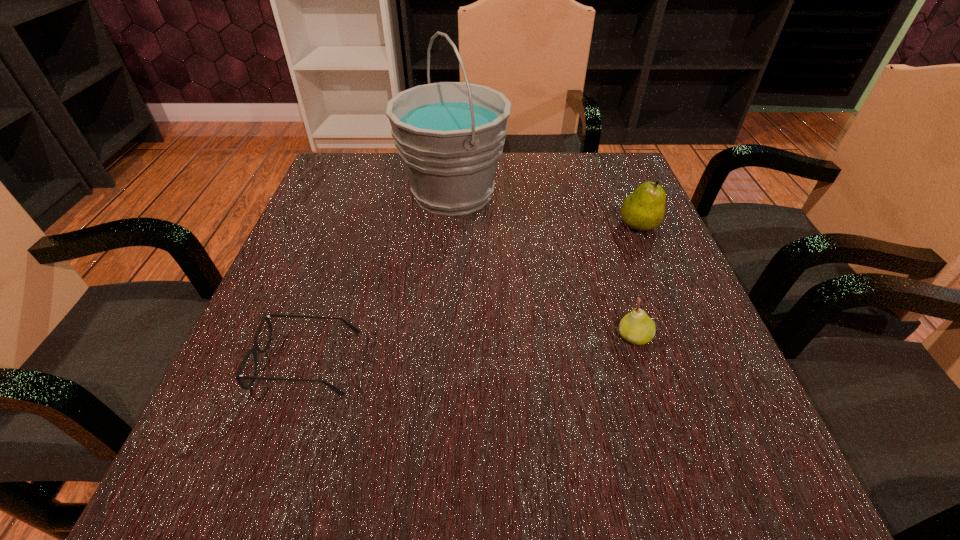
Image resolution: width=960 pixels, height=540 pixels. I want to click on the tallest object, so click(450, 135).

In order to click on the third object from right to left in this screenshot , I will do `click(450, 135)`.

At what (x,y) coordinates should I click in order to perform the action: click on the farther pear. Please return your answer as a coordinate pair (x, y). The height and width of the screenshot is (540, 960). Looking at the image, I should click on (644, 209).

Image resolution: width=960 pixels, height=540 pixels. I want to click on the second tallest object, so click(x=644, y=209).

This screenshot has width=960, height=540. Identify the location of the nearer pear. (637, 328).

The image size is (960, 540). Find the location of `the second shortest object`. the second shortest object is located at coordinates (637, 328).

At what (x,y) coordinates should I click in order to perform the action: click on the leftmost object. Please return your answer as a coordinate pair (x, y). The image size is (960, 540). Looking at the image, I should click on (255, 348).

The image size is (960, 540). Find the location of `spectacles`. spectacles is located at coordinates (255, 348).

This screenshot has height=540, width=960. I want to click on vacant area located on the right of the third object from right to left, so click(x=594, y=193).

Identify the location of free spot located on the back of the third shortest object. The width and height of the screenshot is (960, 540). (609, 157).